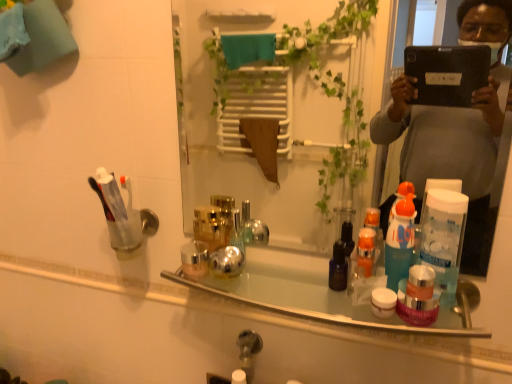
Question: From the image's perspective, is clear plastic cup at left over shiny metallic bottles at center?

Choices:
 (A) yes
 (B) no

Answer: (A)

Question: Considering the relative sizes of clear plastic cup at left and shiny metallic bottles at center in the image provided, is clear plastic cup at left shorter than shiny metallic bottles at center?

Choices:
 (A) no
 (B) yes

Answer: (A)

Question: Is clear plastic cup at left at the right side of shiny metallic bottles at center?

Choices:
 (A) no
 (B) yes

Answer: (A)

Question: Is shiny metallic bottles at center surrounded by clear plastic cup at left?

Choices:
 (A) yes
 (B) no

Answer: (B)

Question: From a real-world perspective, is clear plastic cup at left on shiny metallic bottles at center?

Choices:
 (A) no
 (B) yes

Answer: (B)

Question: Does clear plastic cup at left come in front of shiny metallic bottles at center?

Choices:
 (A) no
 (B) yes

Answer: (A)

Question: Can you confirm if shiny metallic bottles at center is thinner than clear glass mirror at center?

Choices:
 (A) yes
 (B) no

Answer: (B)

Question: From the image's perspective, is shiny metallic bottles at center over clear glass mirror at center?

Choices:
 (A) yes
 (B) no

Answer: (B)

Question: Considering the relative sizes of shiny metallic bottles at center and clear glass mirror at center in the image provided, is shiny metallic bottles at center smaller than clear glass mirror at center?

Choices:
 (A) no
 (B) yes

Answer: (B)

Question: Does shiny metallic bottles at center have a greater height compared to clear glass mirror at center?

Choices:
 (A) yes
 (B) no

Answer: (B)

Question: Is shiny metallic bottles at center positioned before clear glass mirror at center?

Choices:
 (A) yes
 (B) no

Answer: (B)

Question: Can you confirm if shiny metallic bottles at center is wider than clear glass mirror at center?

Choices:
 (A) no
 (B) yes

Answer: (B)

Question: From a real-world perspective, is clear glass mirror at center on shiny metallic bottles at center?

Choices:
 (A) no
 (B) yes

Answer: (B)